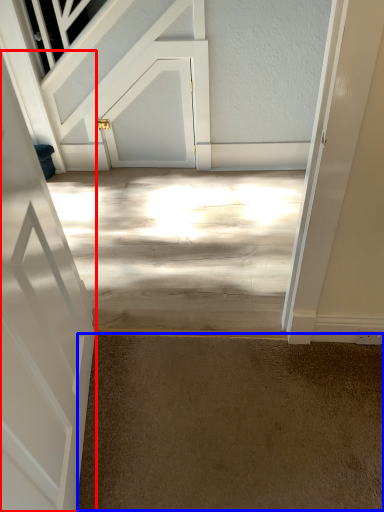
Question: Which object is further to the camera taking this photo, door (highlighted by a red box) or concrete (highlighted by a blue box)?

Choices:
 (A) door
 (B) concrete

Answer: (B)